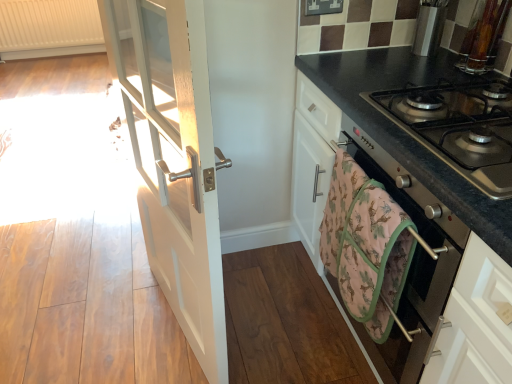
Describe the element at coordinates (174, 159) in the screenshot. I see `white wood door at left` at that location.

What is the approximate width of stainless steel gas stove at right?

It is 19.45 inches.

What is the approximate width of metallic oven at right?

metallic oven at right is 24.22 inches wide.

What is the approximate width of white textured radiator at upper left?

white textured radiator at upper left is 5.36 inches wide.

The width and height of the screenshot is (512, 384). What do you see at coordinates (49, 28) in the screenshot? I see `white textured radiator at upper left` at bounding box center [49, 28].

Find the location of a particular element. The image size is (512, 384). white wood door at left is located at coordinates (174, 159).

Is white wood door at left oriented towards white textured radiator at upper left?

No, white wood door at left is not facing towards white textured radiator at upper left.

Considering the sizes of objects white wood door at left and white textured radiator at upper left in the image provided, who is taller, white wood door at left or white textured radiator at upper left?

Standing taller between the two is white wood door at left.

From a real-world perspective, between white wood door at left and white textured radiator at upper left, who is vertically higher?

white wood door at left.

Is point (131, 85) more distant than point (6, 33)?

No, (131, 85) is in front of (6, 33).

Are metallic oven at right and pink fabric hand towel at lower right beside each other?

No, metallic oven at right is not next to pink fabric hand towel at lower right.

Is metallic oven at right at the right side of pink fabric hand towel at lower right?

Indeed, metallic oven at right is positioned on the right side of pink fabric hand towel at lower right.

In the scene shown: From a real-world perspective, is metallic oven at right located higher than pink fabric hand towel at lower right?

No, from a real-world perspective, metallic oven at right is not on top of pink fabric hand towel at lower right.

Considering the relative positions of metallic oven at right and pink fabric hand towel at lower right in the image provided, is metallic oven at right behind pink fabric hand towel at lower right?

No, metallic oven at right is in front of pink fabric hand towel at lower right.

Which is less distant, (219,279) or (511,175)?

Point (219,279) is farther from the camera than point (511,175).

Where is `door in front of the stainless steel gas stove at right`? door in front of the stainless steel gas stove at right is located at coordinates pos(174,159).

How different are the orientations of white wood door at left and stainless steel gas stove at right in degrees?

white wood door at left and stainless steel gas stove at right are facing 15.6 degrees away from each other.

Considering the sizes of objects white wood door at left and stainless steel gas stove at right in the image provided, who is bigger, white wood door at left or stainless steel gas stove at right?

With larger size is white wood door at left.

Does metallic oven at right have a lesser width compared to white textured radiator at upper left?

Incorrect, the width of metallic oven at right is not less than that of white textured radiator at upper left.

Looking at this image, measure the distance from metallic oven at right to white textured radiator at upper left.

metallic oven at right and white textured radiator at upper left are 3.95 meters apart from each other.

Considering the sizes of metallic oven at right and white textured radiator at upper left in the image, is metallic oven at right taller or shorter than white textured radiator at upper left?

Clearly, metallic oven at right is taller compared to white textured radiator at upper left.

Is pink fabric hand towel at lower right next to metallic oven at right and touching it?

No, pink fabric hand towel at lower right is not in contact with metallic oven at right.

Based on their sizes in the image, would you say pink fabric hand towel at lower right is bigger or smaller than metallic oven at right?

Clearly, pink fabric hand towel at lower right is smaller in size than metallic oven at right.

Which object is positioned more to the right, pink fabric hand towel at lower right or metallic oven at right?

From the viewer's perspective, metallic oven at right appears more on the right side.

Based on the photo, which is behind, pink fabric hand towel at lower right or metallic oven at right?

pink fabric hand towel at lower right is behind.

Does stainless steel gas stove at right have a greater height compared to pink fabric hand towel at lower right?

No, stainless steel gas stove at right is not taller than pink fabric hand towel at lower right.

Is stainless steel gas stove at right at the left side of pink fabric hand towel at lower right?

In fact, stainless steel gas stove at right is to the right of pink fabric hand towel at lower right.

From the image's perspective, between stainless steel gas stove at right and pink fabric hand towel at lower right, which one is located above?

stainless steel gas stove at right is shown above in the image.

Considering the relative sizes of stainless steel gas stove at right and pink fabric hand towel at lower right in the image provided, is stainless steel gas stove at right smaller than pink fabric hand towel at lower right?

Incorrect, stainless steel gas stove at right is not smaller in size than pink fabric hand towel at lower right.

Considering the relative sizes of pink fabric hand towel at lower right and white wood door at left in the image provided, is pink fabric hand towel at lower right shorter than white wood door at left?

Indeed, pink fabric hand towel at lower right has a lesser height compared to white wood door at left.

Is pink fabric hand towel at lower right to the left of white wood door at left from the viewer's perspective?

No, pink fabric hand towel at lower right is not to the left of white wood door at left.

Is pink fabric hand towel at lower right with white wood door at left?

No, pink fabric hand towel at lower right is not touching white wood door at left.

Is pink fabric hand towel at lower right facing towards white wood door at left?

No, pink fabric hand towel at lower right does not turn towards white wood door at left.

This screenshot has width=512, height=384. Identify the location of door located on the right of white textured radiator at upper left. (174, 159).

The width and height of the screenshot is (512, 384). In order to click on cabinetry below the pink fabric hand towel at lower right (from a real-world perspective) in this screenshot , I will do `click(393, 197)`.

Based on their spatial positions, is white wood door at left or white textured radiator at upper left further from stainless steel gas stove at right?

The object further to stainless steel gas stove at right is white textured radiator at upper left.

Based on their spatial positions, is metallic oven at right or white textured radiator at upper left further from stainless steel gas stove at right?

Based on the image, white textured radiator at upper left appears to be further to stainless steel gas stove at right.

In the scene shown: From the image, which object appears to be nearer to white wood door at left, metallic oven at right or white textured radiator at upper left?

metallic oven at right.

Based on their spatial positions, is stainless steel gas stove at right or white textured radiator at upper left closer to metallic oven at right?

The object closer to metallic oven at right is stainless steel gas stove at right.

Based on their spatial positions, is pink fabric hand towel at lower right or white textured radiator at upper left closer to metallic oven at right?

Based on the image, pink fabric hand towel at lower right appears to be nearer to metallic oven at right.

In the scene shown: Considering their positions, is stainless steel gas stove at right positioned further to pink fabric hand towel at lower right than metallic oven at right?

stainless steel gas stove at right.

Which object lies further to the anchor point metallic oven at right, white wood door at left or white textured radiator at upper left?

Based on the image, white textured radiator at upper left appears to be further to metallic oven at right.

Estimate the real-world distances between objects in this image. Which object is closer to white textured radiator at upper left, white wood door at left or pink fabric hand towel at lower right?

white wood door at left is positioned closer to the anchor white textured radiator at upper left.

You are a GUI agent. You are given a task and a screenshot of the screen. Output one action in this format:
    pyautogui.click(x=<x>, y=<y>)
    Task: Click on the cabinetry between white wood door at left and stainless steel gas stove at right
    Image resolution: width=512 pixels, height=384 pixels.
    Given the screenshot: What is the action you would take?
    pyautogui.click(x=393, y=197)

Locate an element on the screen. cabinetry between stainless steel gas stove at right and pink fabric hand towel at lower right in the vertical direction is located at coordinates (393, 197).

You are a GUI agent. You are given a task and a screenshot of the screen. Output one action in this format:
    pyautogui.click(x=<x>, y=<y>)
    Task: Click on the hand towel between stainless steel gas stove at right and white textured radiator at upper left in the front-back direction
    The height and width of the screenshot is (384, 512).
    Given the screenshot: What is the action you would take?
    pyautogui.click(x=366, y=246)

You are a GUI agent. You are given a task and a screenshot of the screen. Output one action in this format:
    pyautogui.click(x=<x>, y=<y>)
    Task: Click on the hand towel between metallic oven at right and white textured radiator at upper left in the front-back direction
    This screenshot has width=512, height=384.
    Given the screenshot: What is the action you would take?
    tap(366, 246)